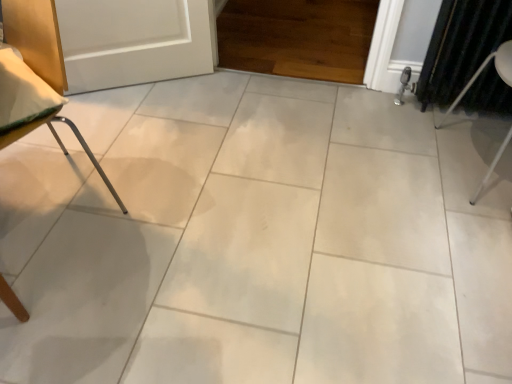
Where is `free spot in front of white metal chair at right, the second furniture viewed from the left`? free spot in front of white metal chair at right, the second furniture viewed from the left is located at coordinates [473, 229].